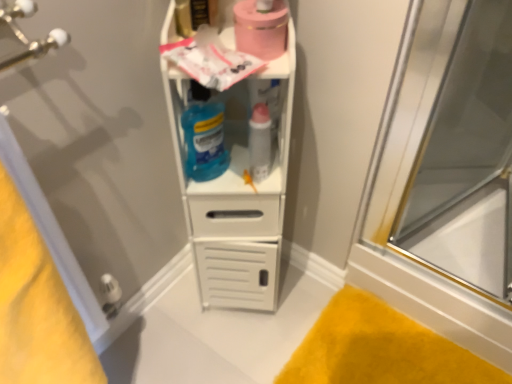
Identify the location of free space above yellow plush bath mat at lower right (from a real-world perspective). This screenshot has width=512, height=384. (382, 350).